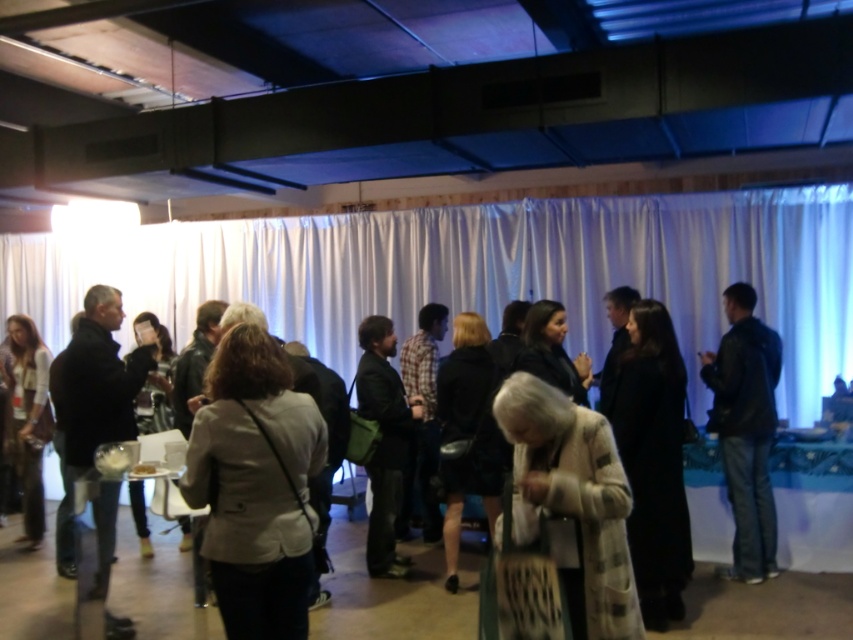
Is light beige jacket at center to the left of white textured coat at center from the viewer's perspective?

Correct, you'll find light beige jacket at center to the left of white textured coat at center.

Is light beige jacket at center smaller than white textured coat at center?

No, light beige jacket at center is not smaller than white textured coat at center.

Locate an element on the screen. This screenshot has width=853, height=640. light beige jacket at center is located at coordinates (254, 484).

Is light beige jacket at center behind black leather jacket at left?

No, light beige jacket at center is in front of black leather jacket at left.

Which is in front, point (285, 372) or point (88, 301)?

Point (285, 372) is in front.

This screenshot has height=640, width=853. In order to click on light beige jacket at center in this screenshot , I will do `click(254, 484)`.

Is black wool coat at center wider than black leather jacket at right?

In fact, black wool coat at center might be narrower than black leather jacket at right.

Describe the element at coordinates (653, 460) in the screenshot. I see `black wool coat at center` at that location.

Does point (625, 324) come in front of point (757, 556)?

No, it is behind (757, 556).

At what (x,y) coordinates should I click in order to perform the action: click on black wool coat at center. Please return your answer as a coordinate pair (x, y). This screenshot has height=640, width=853. Looking at the image, I should click on (653, 460).